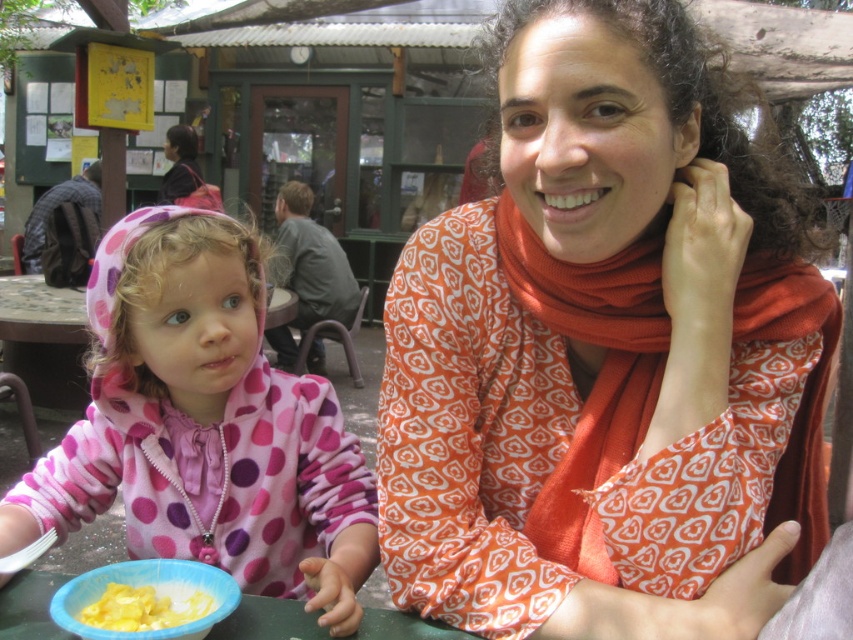
In the scene shown: Does printed orange scarf at center appear under yellow creamy pasta at lower left?

Actually, printed orange scarf at center is above yellow creamy pasta at lower left.

Between printed orange scarf at center and yellow creamy pasta at lower left, which one is positioned lower?

yellow creamy pasta at lower left is lower down.

The height and width of the screenshot is (640, 853). What do you see at coordinates (604, 353) in the screenshot? I see `printed orange scarf at center` at bounding box center [604, 353].

This screenshot has width=853, height=640. I want to click on printed orange scarf at center, so click(604, 353).

From the picture: Does printed orange scarf at center have a lesser height compared to blue plastic bowl at lower center?

No, printed orange scarf at center is not shorter than blue plastic bowl at lower center.

Is point (558, 108) positioned in front of point (16, 632)?

Yes, point (558, 108) is in front of point (16, 632).

Is point (451, 413) farther from viewer compared to point (370, 608)?

No, (451, 413) is closer to viewer.

This screenshot has width=853, height=640. What are the coordinates of `printed orange scarf at center` in the screenshot? It's located at pyautogui.click(x=604, y=353).

Who is taller, pink fleece jacket at left or blue plastic bowl at lower center?

pink fleece jacket at left

This screenshot has height=640, width=853. I want to click on pink fleece jacket at left, so click(204, 426).